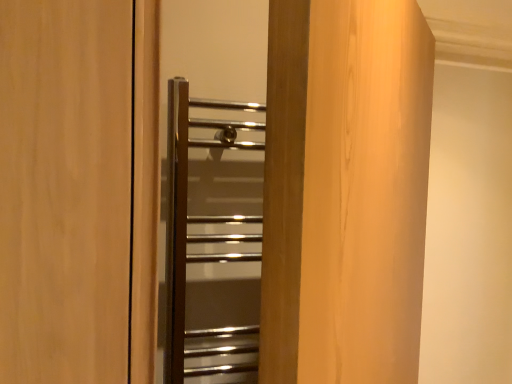
Image resolution: width=512 pixels, height=384 pixels. What do you see at coordinates (65, 190) in the screenshot?
I see `matte wood door at center` at bounding box center [65, 190].

Where is `matte wood door at center`? matte wood door at center is located at coordinates (65, 190).

What is the approximate width of matte wood door at center?

matte wood door at center is 12.56 inches in width.

Locate an element on the screen. Image resolution: width=512 pixels, height=384 pixels. matte wood door at center is located at coordinates (65, 190).